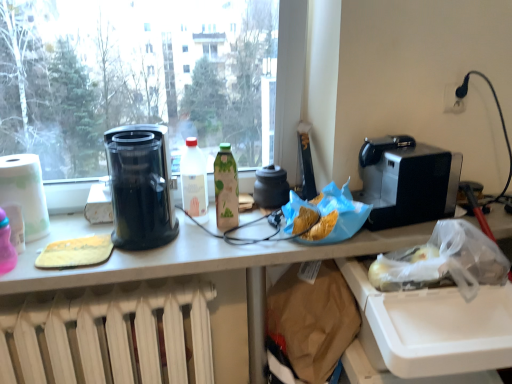
In order to click on free space above transparent plastic coffee maker at left (from a real-world perspective) in this screenshot , I will do `click(135, 134)`.